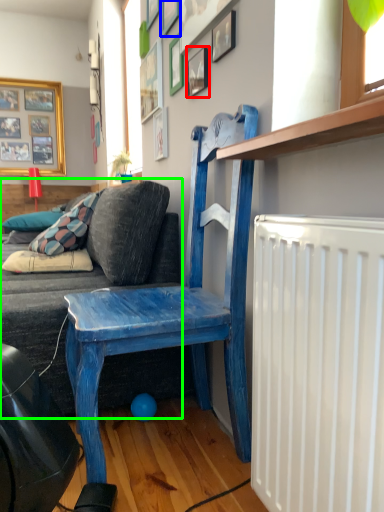
Question: Based on their relative distances, which object is farther from picture frame (highlighted by a red box)? Choose from picture frame (highlighted by a blue box) and studio couch (highlighted by a green box).

Choices:
 (A) picture frame
 (B) studio couch

Answer: (B)